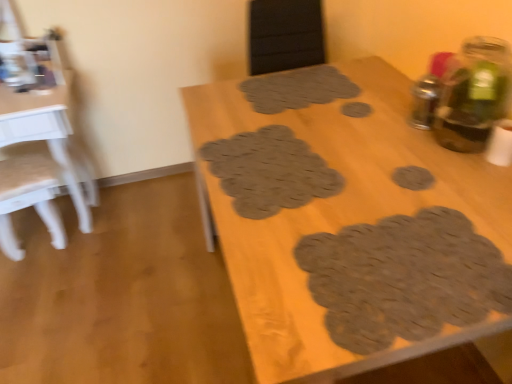
Locate an element on the screen. The width and height of the screenshot is (512, 384). free space that is to the left of brown felt coaster at center, which is counted as the 2th footprint, starting from the back is located at coordinates (330, 121).